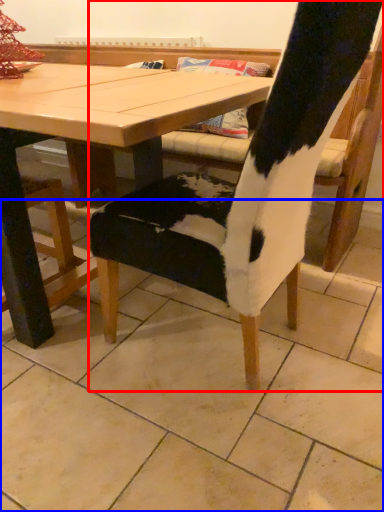
Question: Which of the following is the farthest to the observer, chair (highlighted by a red box) or tile (highlighted by a blue box)?

Choices:
 (A) chair
 (B) tile

Answer: (A)